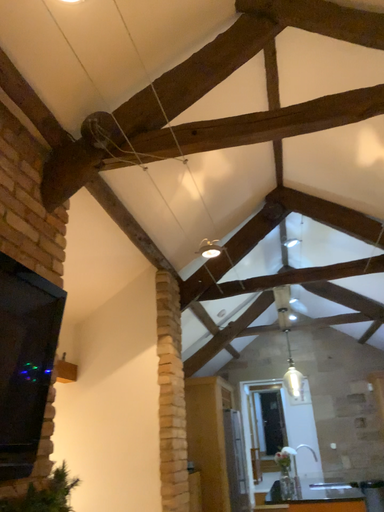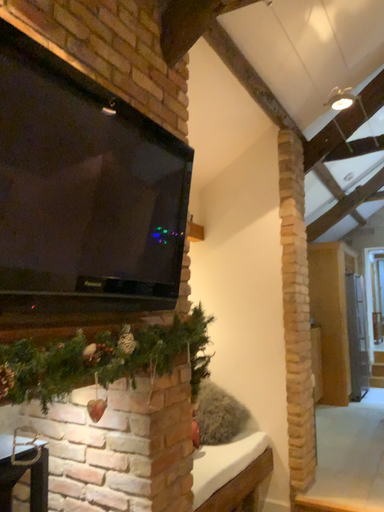
Question: How did the camera likely rotate when shooting the video?

Choices:
 (A) rotated downward
 (B) rotated upward

Answer: (A)